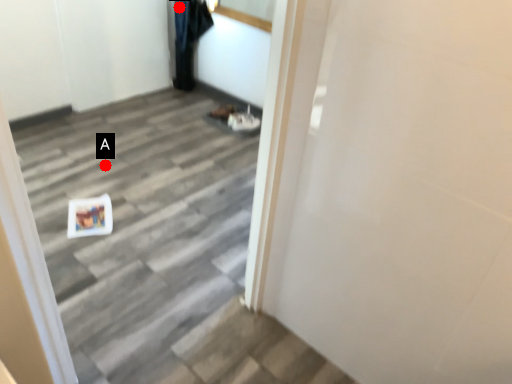
Question: Two points are circled on the image, labeled by A and B beside each circle. Which point is farther from the camera taking this photo?

Choices:
 (A) A is further
 (B) B is further

Answer: (B)